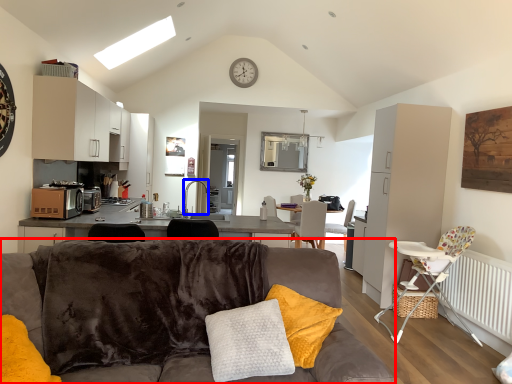
Question: Among these objects, which one is nearest to the camera, studio couch (highlighted by a red box) or faucet (highlighted by a blue box)?

Choices:
 (A) studio couch
 (B) faucet

Answer: (A)